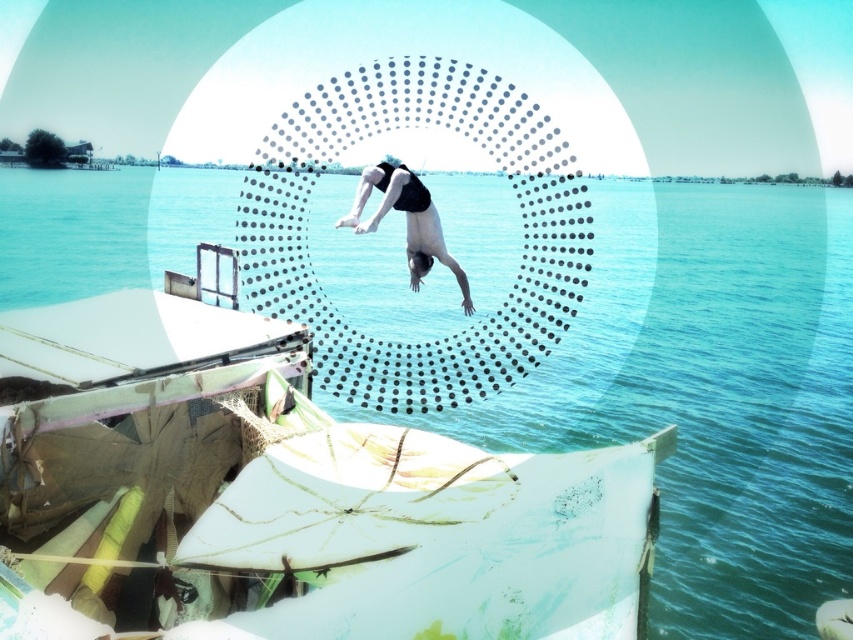
Question: Is clear blue water at center thinner than black matte swimsuit at center?

Choices:
 (A) yes
 (B) no

Answer: (B)

Question: Among these objects, which one is farthest from the camera?

Choices:
 (A) black matte swimsuit at center
 (B) clear blue water at center

Answer: (B)

Question: Does clear blue water at center have a smaller size compared to black matte swimsuit at center?

Choices:
 (A) no
 (B) yes

Answer: (A)

Question: Which point appears closest to the camera in this image?

Choices:
 (A) (749, 589)
 (B) (453, 262)

Answer: (B)

Question: Which object appears closest to the camera in this image?

Choices:
 (A) black matte swimsuit at center
 (B) clear blue water at center

Answer: (A)

Question: Where is clear blue water at center located in relation to black matte swimsuit at center in the image?

Choices:
 (A) above
 (B) below

Answer: (A)